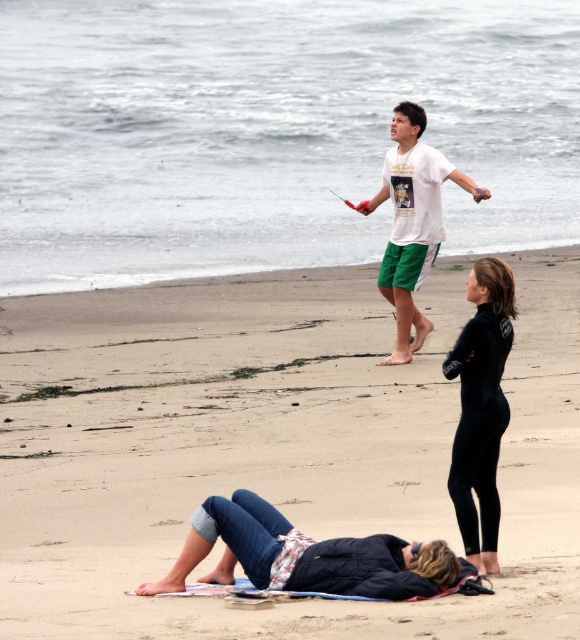
You are standing at the point marked by the coordinate point at (x=357, y=385) and want to walk to the beach house located 16.92 meters away. Is the beach house closer to you or farther than 20 meters?

The beach house is 16.92 meters away from the point marked by the coordinate point at (x=357, y=385), so it is closer than 20 meters.

You are standing at the point marked by the coordinates (480, 406) in the image. Looking around, you see a black wetsuit at lower right. Which direction should you walk to reach the black wetsuit at lower right?

The point at (480, 406) is already at the location of the black wetsuit at lower right, so you don not need to move in any direction to reach it.